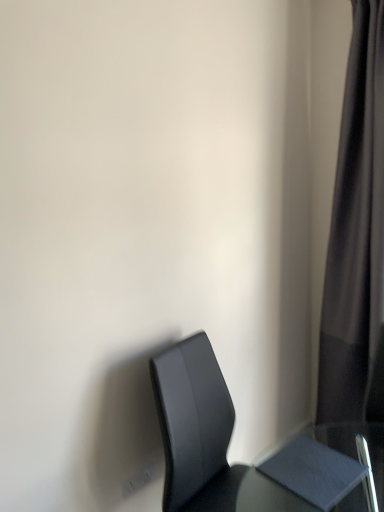
Measure the distance between point (x=356, y=501) and camera.

7.07 feet.

The width and height of the screenshot is (384, 512). Describe the element at coordinates (356, 239) in the screenshot. I see `black fabric curtain at right` at that location.

You are a GUI agent. You are given a task and a screenshot of the screen. Output one action in this format:
    pyautogui.click(x=<x>, y=<y>)
    Task: Click on the black fabric curtain at right
    This screenshot has width=384, height=512.
    Given the screenshot: What is the action you would take?
    pyautogui.click(x=356, y=239)

Where is `matte black chair at lower right`? matte black chair at lower right is located at coordinates (262, 462).

Identify the location of matte gray table at lower right. Image resolution: width=384 pixels, height=512 pixels. (354, 446).

How distant is matte black chair at lower right from matte gray table at lower right?

matte black chair at lower right and matte gray table at lower right are 95.81 centimeters apart from each other.

From the image's perspective, is matte black chair at lower right over matte gray table at lower right?

No, from the image's perspective, matte black chair at lower right is not on top of matte gray table at lower right.

From a real-world perspective, which is physically below, matte black chair at lower right or matte gray table at lower right?

From a 3D spatial view, matte black chair at lower right is below.

Does matte black chair at lower right have a larger size compared to matte gray table at lower right?

Correct, matte black chair at lower right is larger in size than matte gray table at lower right.

Which object is wider, black fabric curtain at right or matte black chair at lower right?

matte black chair at lower right is wider.

Considering the relative sizes of black fabric curtain at right and matte black chair at lower right in the image provided, is black fabric curtain at right taller than matte black chair at lower right?

Yes, black fabric curtain at right is taller than matte black chair at lower right.

Is black fabric curtain at right far from matte black chair at lower right?

black fabric curtain at right is near matte black chair at lower right, not far away.

Is point (251, 508) closer or farther from the camera than point (358, 26)?

Point (251, 508) is positioned closer to the camera compared to point (358, 26).

Is matte gray table at lower right not near black fabric curtain at right?

No, there isn't a large distance between matte gray table at lower right and black fabric curtain at right.

Where is `table below the black fabric curtain at right (from the image's perspective)`? table below the black fabric curtain at right (from the image's perspective) is located at coordinates (354, 446).

Is matte gray table at lower right located outside black fabric curtain at right?

Yes.

Can you tell me how much matte gray table at lower right and matte black chair at lower right differ in facing direction?

The facing directions of matte gray table at lower right and matte black chair at lower right are 11.1 degrees apart.

Could matte black chair at lower right be considered to be inside matte gray table at lower right?

No, matte black chair at lower right is not inside matte gray table at lower right.

Who is more distant, matte gray table at lower right or matte black chair at lower right?

matte gray table at lower right is further from the camera.

Considering their positions, is black fabric curtain at right located in front of or behind matte gray table at lower right?

Clearly, black fabric curtain at right is behind matte gray table at lower right.

Is black fabric curtain at right aimed at matte gray table at lower right?

Yes, black fabric curtain at right is oriented towards matte gray table at lower right.

Which is more to the left, black fabric curtain at right or matte gray table at lower right?

matte gray table at lower right.

Can you tell me how much black fabric curtain at right and matte gray table at lower right differ in facing direction?

The angle between the facing direction of black fabric curtain at right and the facing direction of matte gray table at lower right is 86.2 degrees.

Which is more to the right, matte black chair at lower right or black fabric curtain at right?

Positioned to the right is black fabric curtain at right.

Is matte black chair at lower right located outside black fabric curtain at right?

Yes, matte black chair at lower right is outside of black fabric curtain at right.

Which is less distant, (325, 507) or (383, 324)?

Point (325, 507) is closer to the camera than point (383, 324).

At what (x,y) coordinates should I click in order to perform the action: click on table above the matte black chair at lower right (from the image's perspective). Please return your answer as a coordinate pair (x, y). This screenshot has width=384, height=512. Looking at the image, I should click on (354, 446).

At what (x,y) coordinates should I click in order to perform the action: click on chair below the black fabric curtain at right (from a real-world perspective). Please return your answer as a coordinate pair (x, y). This screenshot has height=512, width=384. Looking at the image, I should click on (262, 462).

Which object lies further to the anchor point matte black chair at lower right, black fabric curtain at right or matte gray table at lower right?

Among the two, black fabric curtain at right is located further to matte black chair at lower right.

Based on their spatial positions, is matte gray table at lower right or black fabric curtain at right closer to matte black chair at lower right?

Based on the image, matte gray table at lower right appears to be nearer to matte black chair at lower right.

Looking at the image, which one is located closer to matte gray table at lower right, matte black chair at lower right or black fabric curtain at right?

black fabric curtain at right is closer to matte gray table at lower right.

Based on their spatial positions, is black fabric curtain at right or matte black chair at lower right closer to matte gray table at lower right?

Based on the image, black fabric curtain at right appears to be nearer to matte gray table at lower right.

Looking at the image, which one is located further to black fabric curtain at right, matte gray table at lower right or matte black chair at lower right?

matte black chair at lower right.

From the image, which object appears to be farther from black fabric curtain at right, matte black chair at lower right or matte gray table at lower right?

The object further to black fabric curtain at right is matte black chair at lower right.

I want to click on table between black fabric curtain at right and matte black chair at lower right in the up-down direction, so click(x=354, y=446).